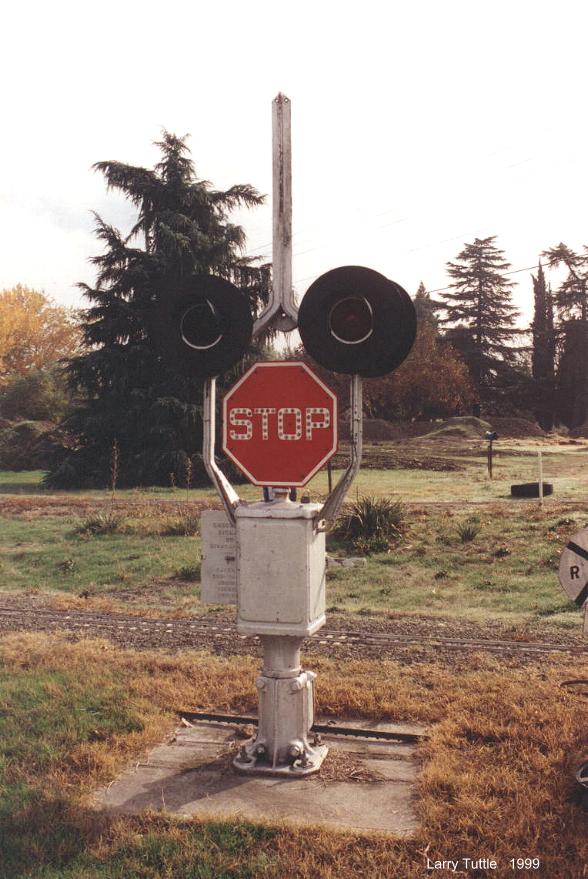
Image resolution: width=588 pixels, height=879 pixels. I want to click on lights, so click(358, 323), click(196, 323).